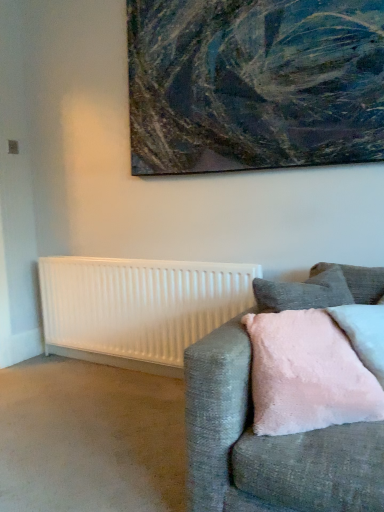
Question: Is textured canvas painting at upper center oriented towards pink fluffy pillow at right?

Choices:
 (A) yes
 (B) no

Answer: (B)

Question: Considering the relative sizes of textured canvas painting at upper center and pink fluffy pillow at right in the image provided, is textured canvas painting at upper center smaller than pink fluffy pillow at right?

Choices:
 (A) yes
 (B) no

Answer: (B)

Question: Is textured canvas painting at upper center not near pink fluffy pillow at right?

Choices:
 (A) yes
 (B) no

Answer: (A)

Question: Is textured canvas painting at upper center facing away from pink fluffy pillow at right?

Choices:
 (A) yes
 (B) no

Answer: (B)

Question: Is textured canvas painting at upper center in contact with pink fluffy pillow at right?

Choices:
 (A) no
 (B) yes

Answer: (A)

Question: From the image's perspective, is textured canvas painting at upper center above pink fluffy pillow at right?

Choices:
 (A) yes
 (B) no

Answer: (A)

Question: Is white matte radiator at lower left shorter than pink fluffy pillow at right?

Choices:
 (A) yes
 (B) no

Answer: (B)

Question: From the image's perspective, is white matte radiator at lower left on pink fluffy pillow at right?

Choices:
 (A) no
 (B) yes

Answer: (A)

Question: Can you confirm if white matte radiator at lower left is positioned to the right of pink fluffy pillow at right?

Choices:
 (A) yes
 (B) no

Answer: (B)

Question: Is white matte radiator at lower left outside pink fluffy pillow at right?

Choices:
 (A) no
 (B) yes

Answer: (B)

Question: Can you confirm if white matte radiator at lower left is bigger than pink fluffy pillow at right?

Choices:
 (A) no
 (B) yes

Answer: (B)

Question: Is white matte radiator at lower left smaller than pink fluffy pillow at right?

Choices:
 (A) no
 (B) yes

Answer: (A)

Question: From the image's perspective, is textured canvas painting at upper center above white matte radiator at lower left?

Choices:
 (A) yes
 (B) no

Answer: (A)